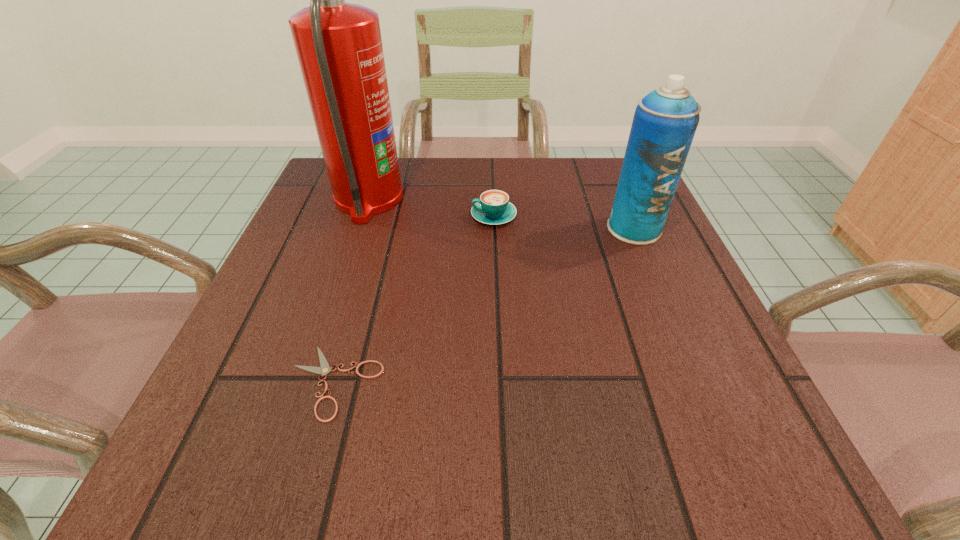
The width and height of the screenshot is (960, 540). I want to click on free space that satisfies the following two spatial constraints: 1. with the handle on the right side of the aerosol can; 2. on the left side of the second shortest object, so click(x=494, y=228).

At what (x,y) coordinates should I click in order to perform the action: click on free spot that satisfies the following two spatial constraints: 1. on the instruction side of the nearest object; 2. on the left side of the tallest object. Please return your answer as a coordinate pair (x, y). The width and height of the screenshot is (960, 540). Looking at the image, I should click on (307, 382).

The image size is (960, 540). Find the location of `free space in the image that satisfies the following two spatial constraints: 1. with the handle on the right side of the third tallest object; 2. on the right side of the rightmost object`. free space in the image that satisfies the following two spatial constraints: 1. with the handle on the right side of the third tallest object; 2. on the right side of the rightmost object is located at coordinates (494, 228).

Locate an element on the screen. This screenshot has height=540, width=960. free location that satisfies the following two spatial constraints: 1. on the back side of the aerosol can; 2. on the instruction side of the tallest object is located at coordinates (622, 200).

I want to click on vacant position in the image that satisfies the following two spatial constraints: 1. with the handle on the right side of the second shortest object; 2. on the back side of the second tallest object, so click(x=494, y=228).

You are a GUI agent. You are given a task and a screenshot of the screen. Output one action in this format:
    pyautogui.click(x=<x>, y=<y>)
    Task: Click on the vacant space that satisfies the following two spatial constraints: 1. on the instruction side of the fire extinguisher; 2. on the right side of the rightmost object
    
    Given the screenshot: What is the action you would take?
    pyautogui.click(x=358, y=228)

The height and width of the screenshot is (540, 960). Find the location of `vacant space that satisfies the following two spatial constraints: 1. on the instruction side of the fire extinguisher; 2. on the back side of the nearest object`. vacant space that satisfies the following two spatial constraints: 1. on the instruction side of the fire extinguisher; 2. on the back side of the nearest object is located at coordinates (307, 382).